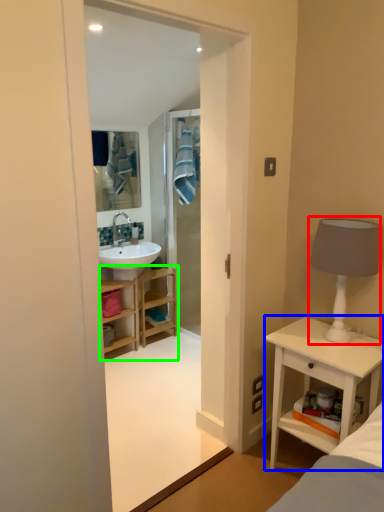
Question: Considering the real-world distances, which object is farthest from table lamp (highlighted by a red box)? nightstand (highlighted by a blue box) or bathroom cabinet (highlighted by a green box)?

Choices:
 (A) nightstand
 (B) bathroom cabinet

Answer: (B)